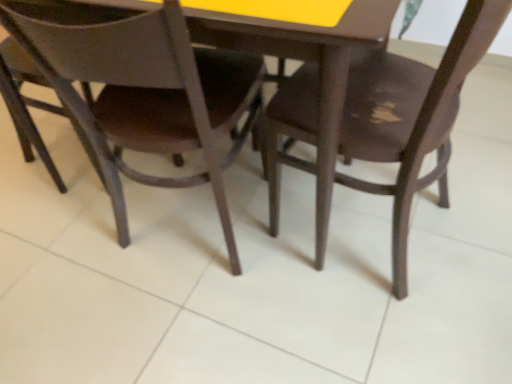
Identify the location of free location in front of dark wood chair at center, which is the 2th chair from left to right. coord(388,329).